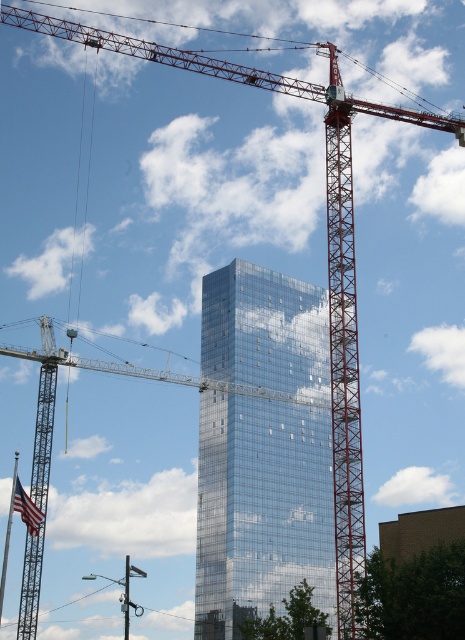
Is point (311, 582) behind point (30, 548)?

Yes, it is.

Can you confirm if glassy reflective skyscraper at center is taller than metallic gray crane at center?

Yes.

Find the location of a particular element. The image size is (465, 640). glassy reflective skyscraper at center is located at coordinates (260, 508).